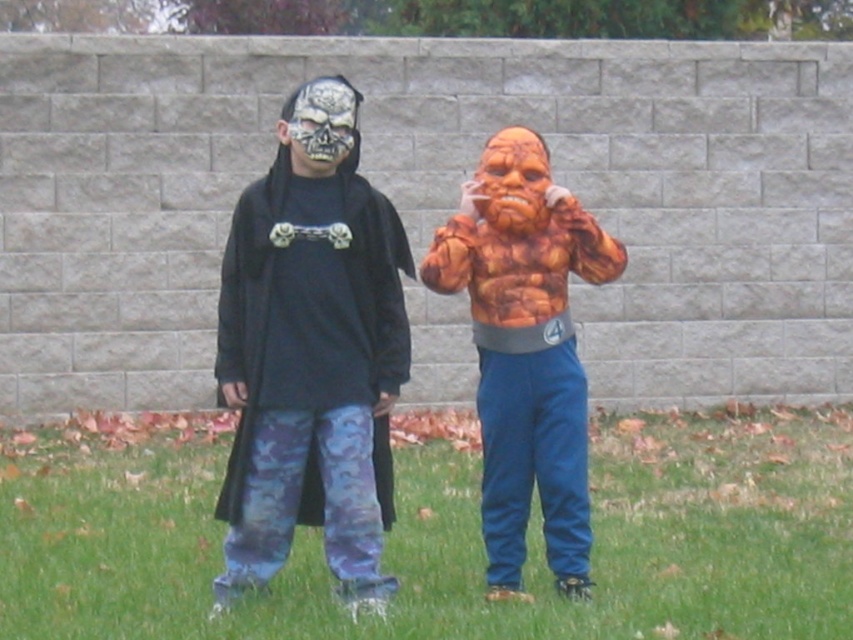
Question: Considering the relative positions of green grass at lower center and matte black costume at center in the image provided, where is green grass at lower center located with respect to matte black costume at center?

Choices:
 (A) below
 (B) above

Answer: (A)

Question: Does orange textured muscle suit at center have a greater width compared to shiny silver skull mask at center?

Choices:
 (A) yes
 (B) no

Answer: (A)

Question: Which object is farther from the camera taking this photo?

Choices:
 (A) matte black t-shirt at center
 (B) rubberized orange mask at center

Answer: (B)

Question: Observing the image, what is the correct spatial positioning of green grass at lower center in reference to orange textured muscle suit at center?

Choices:
 (A) left
 (B) right

Answer: (A)

Question: Which object is positioned farthest from the orange textured muscle suit at center?

Choices:
 (A) shiny silver skull mask at center
 (B) matte black t-shirt at center
 (C) green grass at lower center
 (D) matte black costume at center

Answer: (C)

Question: Among these objects, which one is farthest from the camera?

Choices:
 (A) matte black costume at center
 (B) rubberized orange mask at center

Answer: (B)